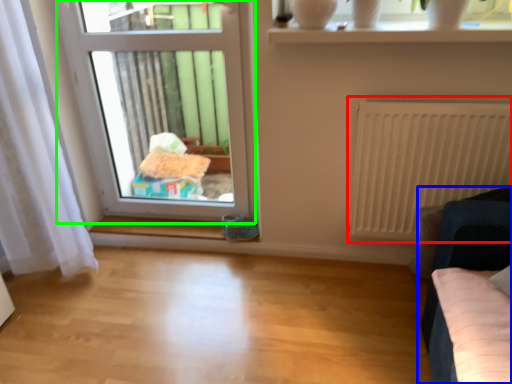
Question: Which is farther away from radiator (highlighted by a red box)? furniture (highlighted by a blue box) or window (highlighted by a green box)?

Choices:
 (A) furniture
 (B) window

Answer: (B)